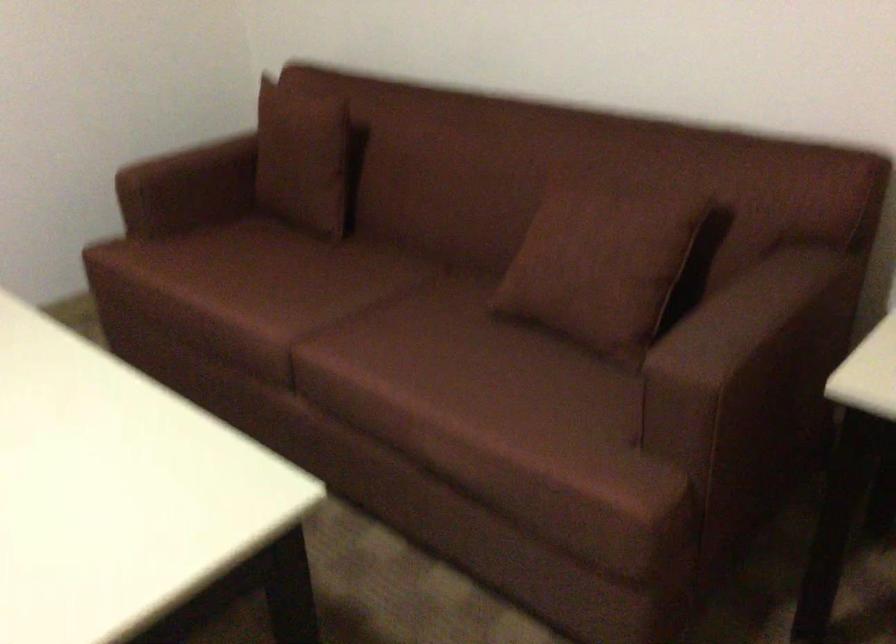
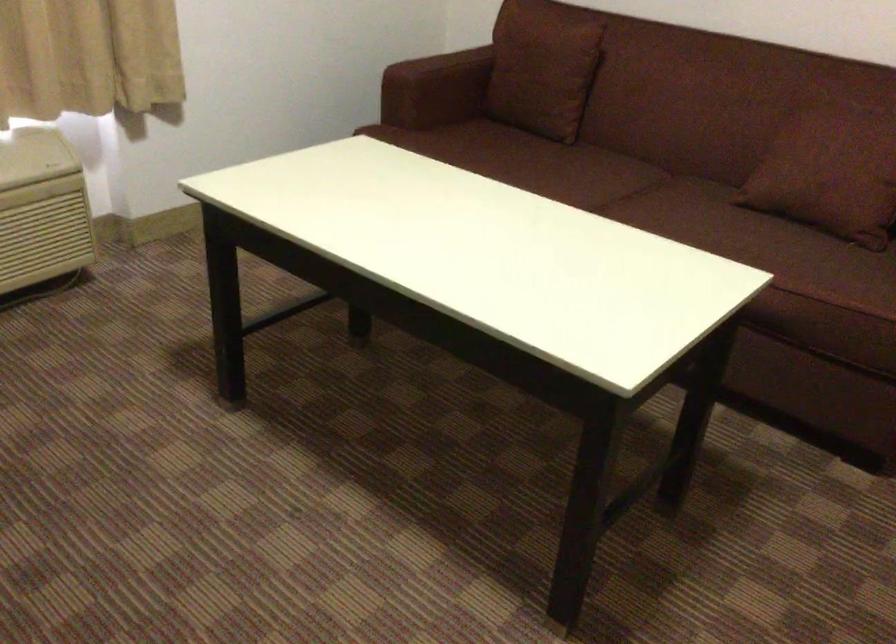
Where in the second image is the point corresponding to the point at 307,294 from the first image?

(574, 176)